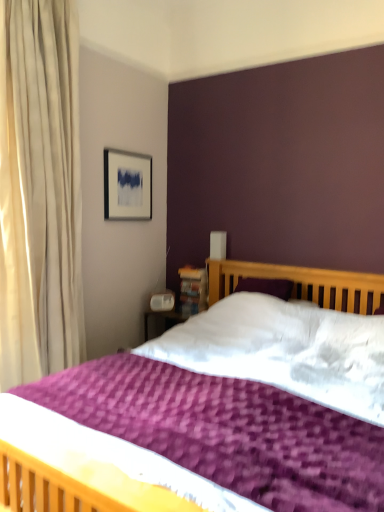
Question: Considering the relative positions of purple textured bed at center and matte silver picture frame at upper left in the image provided, is purple textured bed at center to the right of matte silver picture frame at upper left from the viewer's perspective?

Choices:
 (A) yes
 (B) no

Answer: (A)

Question: Can you confirm if purple textured bed at center is smaller than matte silver picture frame at upper left?

Choices:
 (A) yes
 (B) no

Answer: (B)

Question: Is purple textured bed at center wider than matte silver picture frame at upper left?

Choices:
 (A) no
 (B) yes

Answer: (B)

Question: Is purple textured bed at center shorter than matte silver picture frame at upper left?

Choices:
 (A) yes
 (B) no

Answer: (B)

Question: From a real-world perspective, is purple textured bed at center beneath matte silver picture frame at upper left?

Choices:
 (A) no
 (B) yes

Answer: (B)

Question: Would you say wooden bookshelf at upper right is to the left or to the right of matte silver picture frame at upper left in the picture?

Choices:
 (A) left
 (B) right

Answer: (B)

Question: In terms of width, does wooden bookshelf at upper right look wider or thinner when compared to matte silver picture frame at upper left?

Choices:
 (A) thin
 (B) wide

Answer: (B)

Question: Considering their positions, is wooden bookshelf at upper right located in front of or behind matte silver picture frame at upper left?

Choices:
 (A) front
 (B) behind

Answer: (B)

Question: Is wooden bookshelf at upper right taller or shorter than matte silver picture frame at upper left?

Choices:
 (A) tall
 (B) short

Answer: (B)

Question: Is purple textured bed at center in front of or behind wooden bookshelf at upper right in the image?

Choices:
 (A) front
 (B) behind

Answer: (A)

Question: From a real-world perspective, relative to wooden bookshelf at upper right, is purple textured bed at center vertically above or below?

Choices:
 (A) below
 (B) above

Answer: (A)

Question: From the image's perspective, is purple textured bed at center positioned above or below wooden bookshelf at upper right?

Choices:
 (A) above
 (B) below

Answer: (B)

Question: In terms of width, does purple textured bed at center look wider or thinner when compared to wooden bookshelf at upper right?

Choices:
 (A) thin
 (B) wide

Answer: (B)

Question: From the image's perspective, relative to purple textured bed at center, is matte silver picture frame at upper left above or below?

Choices:
 (A) above
 (B) below

Answer: (A)

Question: From their relative heights in the image, would you say matte silver picture frame at upper left is taller or shorter than purple textured bed at center?

Choices:
 (A) short
 (B) tall

Answer: (A)